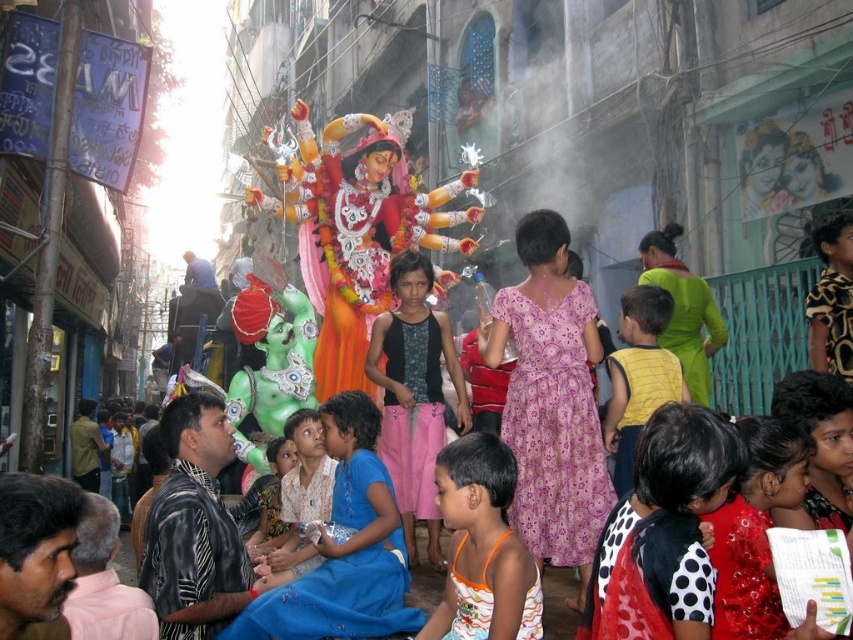
Question: Can you confirm if red satin dress at center is wider than yellow cotton shirt at center?

Choices:
 (A) yes
 (B) no

Answer: (B)

Question: Among these objects, which one is farthest from the camera?

Choices:
 (A) red satin dress at center
 (B) yellow cotton shirt at center
 (C) orange printed tank top at center
 (D) blue fabric dress at center

Answer: (B)

Question: Considering the real-world distances, which object is closest to the red satin dress at center?

Choices:
 (A) blue fabric dress at center
 (B) yellow cotton shirt at center

Answer: (B)

Question: Based on their relative distances, which object is farther from the yellow cotton shirt at center?

Choices:
 (A) orange printed tank top at center
 (B) blue fabric dress at center

Answer: (B)

Question: Can you confirm if red satin dress at center is thinner than blue fabric dress at center?

Choices:
 (A) yes
 (B) no

Answer: (B)

Question: Can you confirm if yellow cotton shirt at center is positioned above blue fabric dress at center?

Choices:
 (A) yes
 (B) no

Answer: (A)